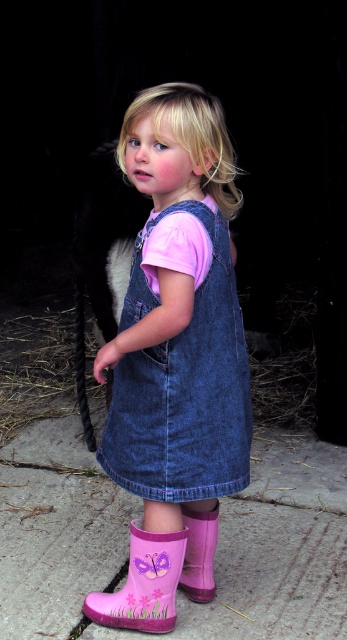
Question: Is pink rubber boots at lower center positioned in front of pink rubber boot at lower center?

Choices:
 (A) no
 (B) yes

Answer: (B)

Question: Which object is the closest to the pink rubber boots at lower center?

Choices:
 (A) pink rubber boot at lower center
 (B) pink rubber boot at lower left

Answer: (B)

Question: Is the position of pink rubber boots at lower center more distant than that of pink rubber boot at lower center?

Choices:
 (A) yes
 (B) no

Answer: (B)

Question: Can you confirm if pink rubber boots at lower center is smaller than pink rubber boot at lower center?

Choices:
 (A) yes
 (B) no

Answer: (B)

Question: Which object is positioned farthest from the pink rubber boots at lower center?

Choices:
 (A) pink rubber boot at lower center
 (B) pink rubber boot at lower left

Answer: (A)

Question: Which object is closer to the camera taking this photo?

Choices:
 (A) pink rubber boots at lower center
 (B) pink rubber boot at lower center
 (C) pink rubber boot at lower left

Answer: (A)